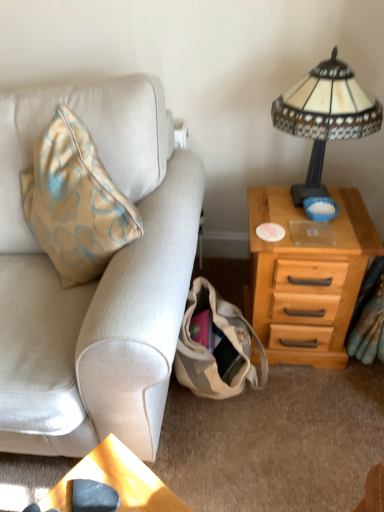
Question: Can beige fabric couch at left be found inside wooden nightstand at right?

Choices:
 (A) no
 (B) yes

Answer: (A)

Question: Is wooden nightstand at right facing away from beige fabric couch at left?

Choices:
 (A) no
 (B) yes

Answer: (A)

Question: Is wooden nightstand at right at the right side of beige fabric couch at left?

Choices:
 (A) no
 (B) yes

Answer: (B)

Question: Is wooden nightstand at right bigger than beige fabric couch at left?

Choices:
 (A) no
 (B) yes

Answer: (A)

Question: From the image's perspective, does wooden nightstand at right appear higher than beige fabric couch at left?

Choices:
 (A) no
 (B) yes

Answer: (A)

Question: In the image, is beige fabric couch at left on the left side or the right side of stained glass lampshade at upper right?

Choices:
 (A) left
 (B) right

Answer: (A)

Question: From the image's perspective, is beige fabric couch at left above or below stained glass lampshade at upper right?

Choices:
 (A) below
 (B) above

Answer: (A)

Question: In the image, is beige fabric couch at left positioned in front of or behind stained glass lampshade at upper right?

Choices:
 (A) front
 (B) behind

Answer: (A)

Question: Is beige fabric couch at left taller or shorter than stained glass lampshade at upper right?

Choices:
 (A) short
 (B) tall

Answer: (B)

Question: From the image's perspective, is stained glass lampshade at upper right positioned above or below wooden nightstand at right?

Choices:
 (A) above
 (B) below

Answer: (A)

Question: Is stained glass lampshade at upper right inside or outside of wooden nightstand at right?

Choices:
 (A) outside
 (B) inside

Answer: (A)

Question: Considering the positions of stained glass lampshade at upper right and wooden nightstand at right in the image, is stained glass lampshade at upper right wider or thinner than wooden nightstand at right?

Choices:
 (A) thin
 (B) wide

Answer: (A)

Question: Is point (326, 195) positioned closer to the camera than point (345, 283)?

Choices:
 (A) closer
 (B) farther

Answer: (B)

Question: Is beige canvas bag at lower center inside or outside of wooden nightstand at right?

Choices:
 (A) outside
 (B) inside

Answer: (A)

Question: From the image's perspective, is beige canvas bag at lower center positioned above or below wooden nightstand at right?

Choices:
 (A) above
 (B) below

Answer: (B)